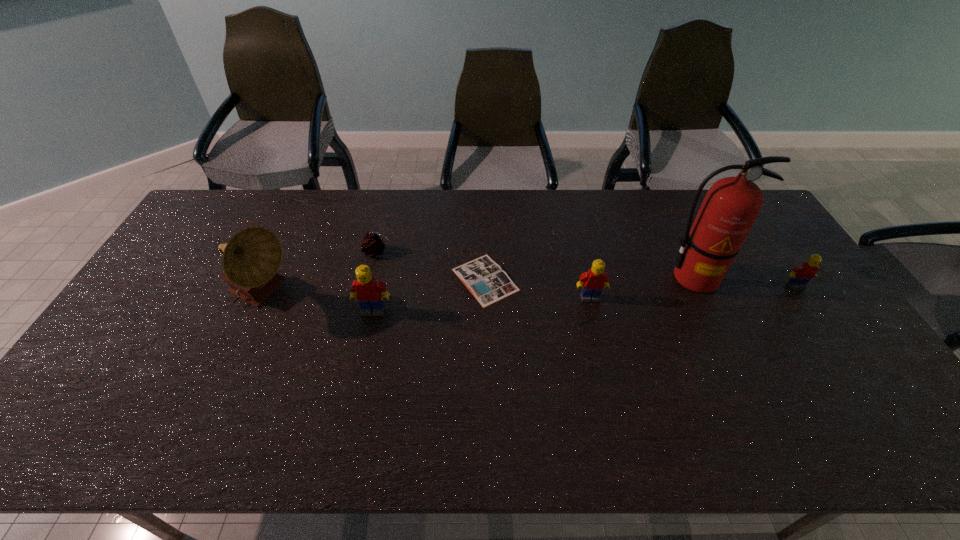
This screenshot has height=540, width=960. In order to click on free space at the far edge in this screenshot , I will do `click(452, 200)`.

Locate an element on the screen. Image resolution: width=960 pixels, height=540 pixels. free space at the right edge of the desktop is located at coordinates (805, 308).

The width and height of the screenshot is (960, 540). In the image, there is a desktop. Identify the location of vacant space at the far left corner. (228, 190).

The image size is (960, 540). What are the coordinates of `vacant space that's between the phonograph record and the nearest Lego` in the screenshot? It's located at (319, 304).

You are a GUI agent. You are given a task and a screenshot of the screen. Output one action in this format:
    pyautogui.click(x=<x>, y=<y>)
    Task: Click on the free space between the rightmost object and the second object from right to left
    The image size is (960, 540).
    Given the screenshot: What is the action you would take?
    pyautogui.click(x=745, y=282)

Locate an element on the screen. free space between the fourth tallest object and the tallest object is located at coordinates (642, 288).

The height and width of the screenshot is (540, 960). Identify the location of free space that is in between the pinecone and the sixth shortest object. 320,274.

Identify the location of free space between the shortest Lego and the third object from right to left. [x=693, y=292].

Point out which object is positioned as the fifth nearest to the fifth tallest object. Please provide its 2D coordinates. Your answer should be formatted as a tuple, i.e. [(x, y)], where the tuple contains the x and y coordinates of a point satisfying the conditions above.

[(373, 244)]

Find the location of a particular element. Image resolution: width=960 pixels, height=540 pixels. object that is the fifth closest one to the fifth tallest object is located at coordinates pos(373,244).